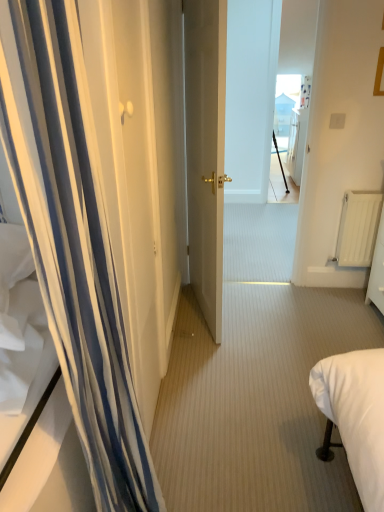
Question: Can you see white striped curtain at left touching matte gold door at center?

Choices:
 (A) no
 (B) yes

Answer: (A)

Question: Is white striped curtain at left bigger than matte gold door at center?

Choices:
 (A) no
 (B) yes

Answer: (A)

Question: Does white striped curtain at left come in front of matte gold door at center?

Choices:
 (A) no
 (B) yes

Answer: (B)

Question: Does white striped curtain at left have a lesser height compared to matte gold door at center?

Choices:
 (A) no
 (B) yes

Answer: (B)

Question: Is white striped curtain at left oriented away from matte gold door at center?

Choices:
 (A) no
 (B) yes

Answer: (A)

Question: Is matte gold door at center a part of white striped curtain at left?

Choices:
 (A) no
 (B) yes

Answer: (A)

Question: Does black matte tripod at center turn towards matte gold door at center?

Choices:
 (A) no
 (B) yes

Answer: (A)

Question: Is black matte tripod at center bigger than matte gold door at center?

Choices:
 (A) no
 (B) yes

Answer: (A)

Question: Is black matte tripod at center wider than matte gold door at center?

Choices:
 (A) yes
 (B) no

Answer: (B)

Question: From a real-world perspective, is black matte tripod at center beneath matte gold door at center?

Choices:
 (A) yes
 (B) no

Answer: (A)

Question: Is matte gold door at center at the back of black matte tripod at center?

Choices:
 (A) no
 (B) yes

Answer: (A)

Question: Does black matte tripod at center appear on the right side of matte gold door at center?

Choices:
 (A) no
 (B) yes

Answer: (B)

Question: Is matte gold door at center far from black matte tripod at center?

Choices:
 (A) yes
 (B) no

Answer: (A)